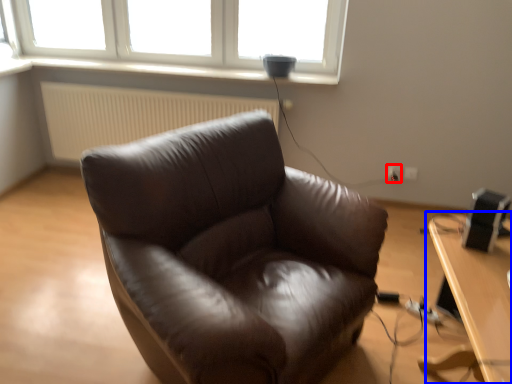
Question: Which point is further to the camera, electric outlet (highlighted by a red box) or table (highlighted by a blue box)?

Choices:
 (A) electric outlet
 (B) table

Answer: (A)